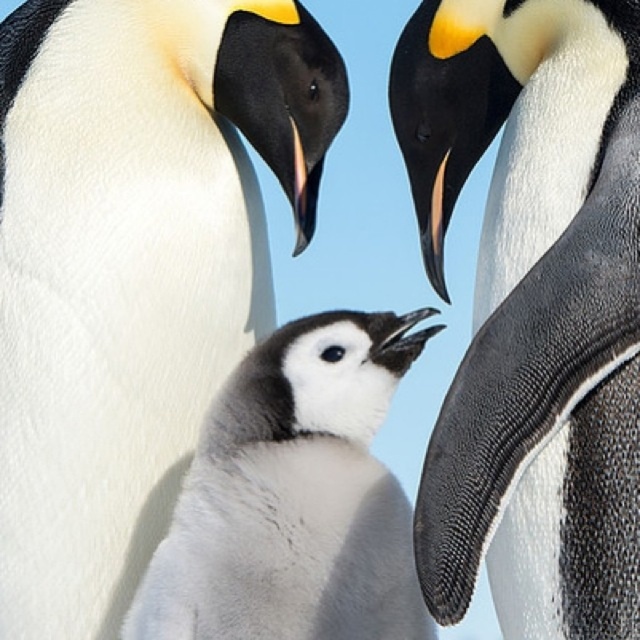
Based on the scene description, where is the white matte penguin at center located in terms of its 2D coordinates?

The white matte penguin at center is located at the 2D coordinates point (532, 308).

You are a wildlife photographer aiming to capture the chick in the center of your photo. Given that the chick is at point (132, 266), what coordinates should you adjust your camera to focus on to ensure the chick is centered?

The white matte penguin chick at center is located at point (132, 266), so you should adjust your camera to focus on those coordinates to center the chick in your photo.